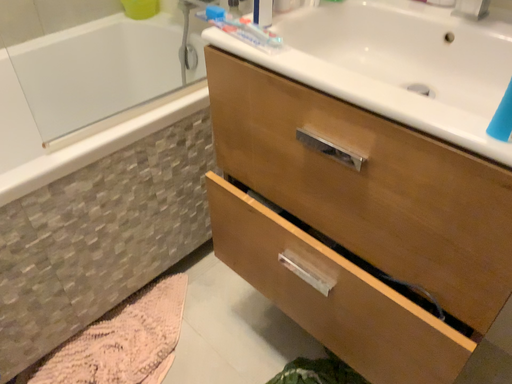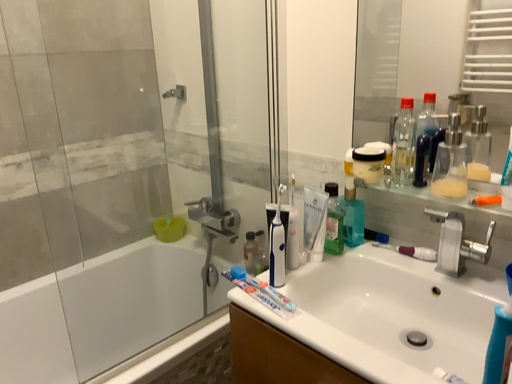
Question: Which way did the camera rotate in the video?

Choices:
 (A) rotated upward
 (B) rotated downward

Answer: (A)